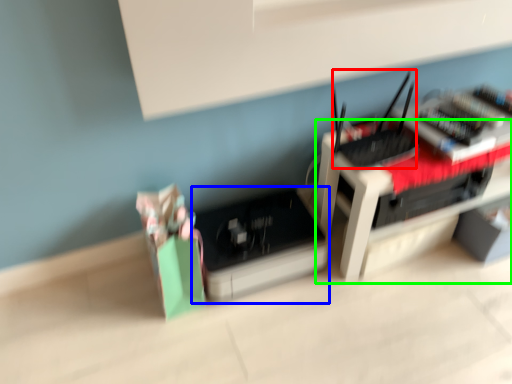
Question: Which object is the farthest from register (highlighted by a red box)? Choose among these: register (highlighted by a blue box) or furniture (highlighted by a green box).

Choices:
 (A) register
 (B) furniture

Answer: (A)